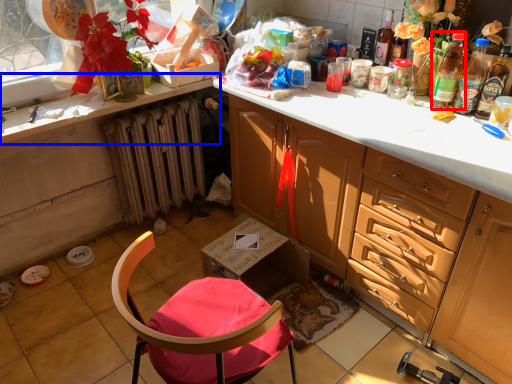
Question: Which object is further to the camera taking this photo, bottle (highlighted by a red box) or countertop (highlighted by a blue box)?

Choices:
 (A) bottle
 (B) countertop

Answer: (B)